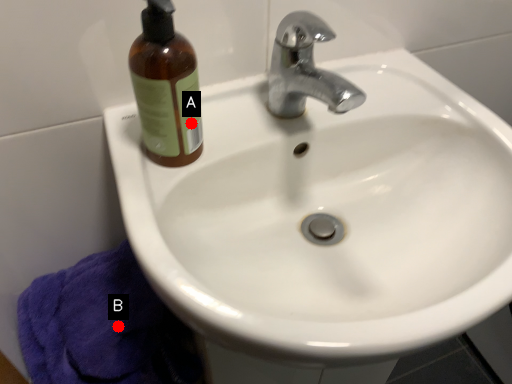
Question: Two points are circled on the image, labeled by A and B beside each circle. Which point appears farthest from the camera in this image?

Choices:
 (A) A is further
 (B) B is further

Answer: (B)